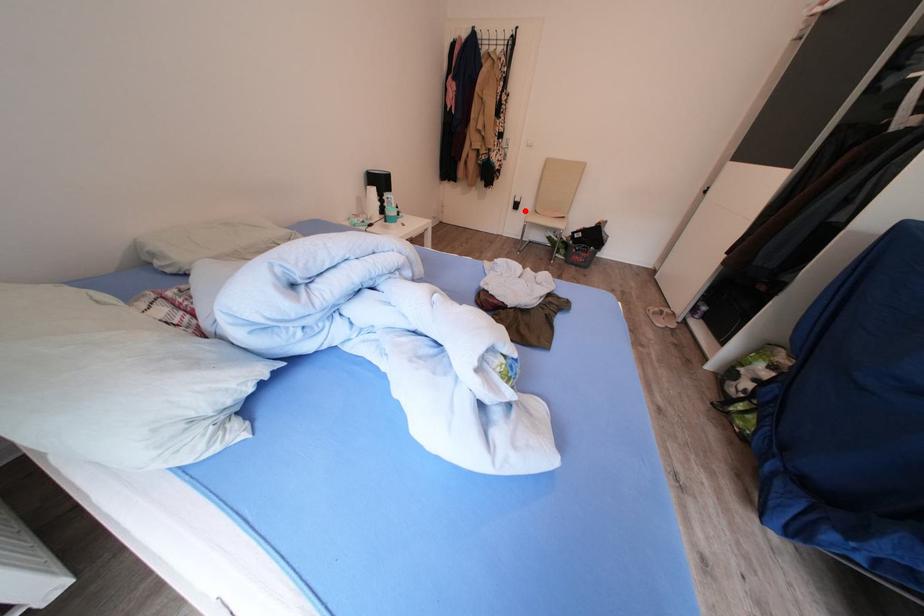
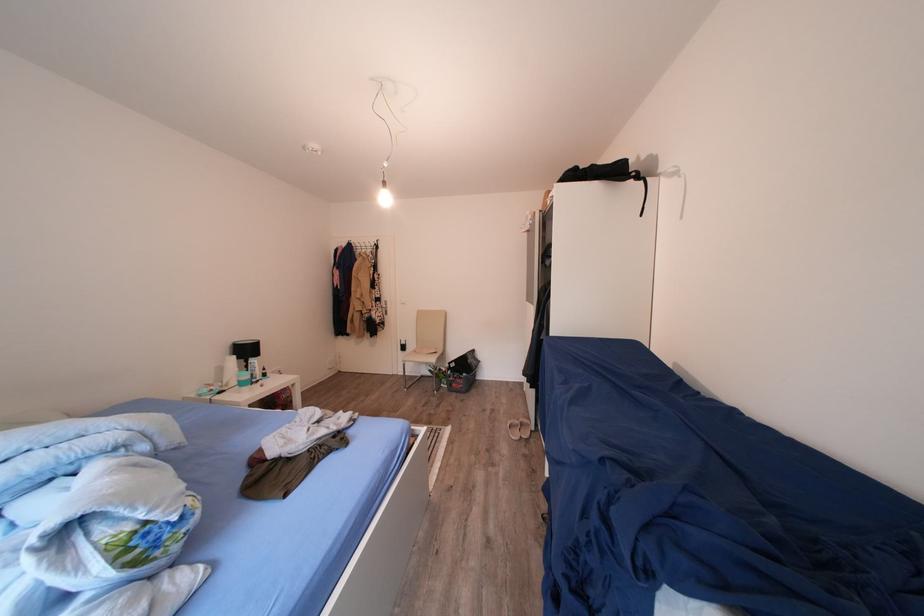
Question: A red point is marked in image1. In image2, is the corresponding 3D point closer to the camera or farther? Reply with the corresponding letter.

Choices:
 (A) The corresponding 3D point is closer.
 (B) The corresponding 3D point is farther.

Answer: (B)